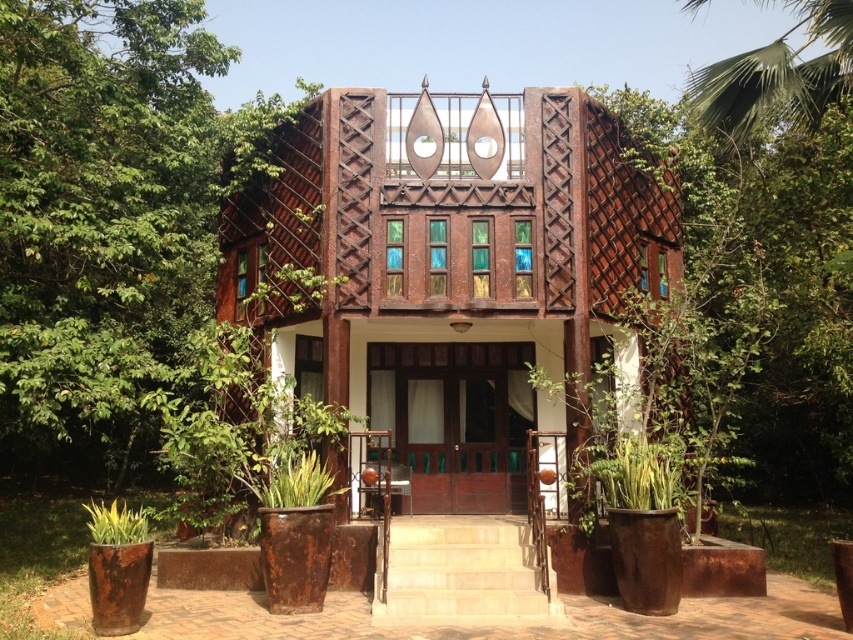
Does green leafy tree at left have a lesser height compared to light brown stone stairs at center?

No.

Is point (91, 209) positioned in front of point (415, 618)?

No, (91, 209) is behind (415, 618).

Does point (102, 256) lie in front of point (492, 525)?

That is True.

This screenshot has height=640, width=853. In order to click on green leafy tree at left in this screenshot , I will do `click(108, 216)`.

Is green leafy tree at left taller than green leafy palm at upper right?

Correct, green leafy tree at left is much taller as green leafy palm at upper right.

Is green leafy tree at left further to camera compared to green leafy palm at upper right?

That is False.

Image resolution: width=853 pixels, height=640 pixels. Find the location of `green leafy tree at left`. green leafy tree at left is located at coordinates (108, 216).

This screenshot has height=640, width=853. I want to click on green leafy tree at left, so click(x=108, y=216).

Is green leafy tree at left wider than green leafy plant at lower left?

Correct, the width of green leafy tree at left exceeds that of green leafy plant at lower left.

Is point (126, 333) positioned in front of point (137, 534)?

No, (126, 333) is behind (137, 534).

In order to click on green leafy tree at left in this screenshot , I will do `click(108, 216)`.